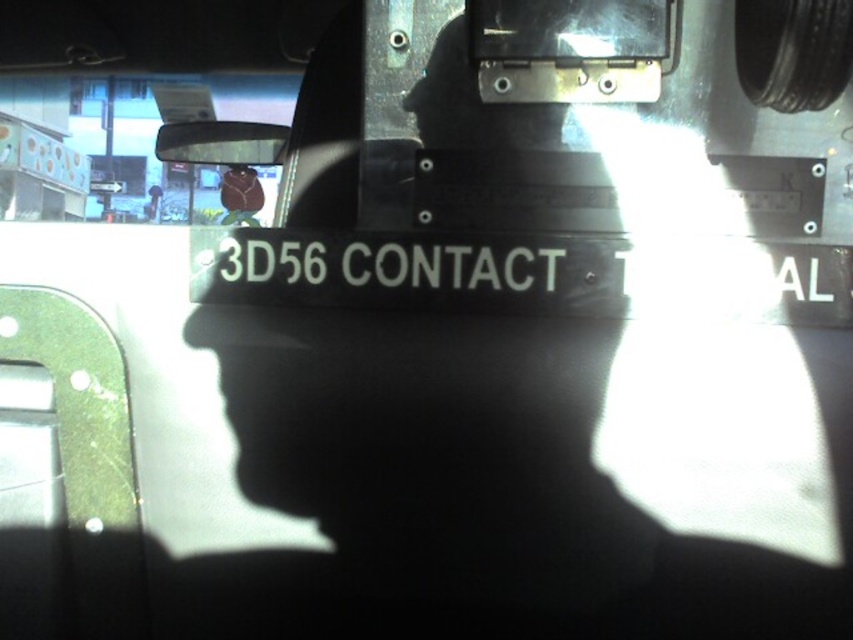
Question: Is white plastic sign at center bigger than clear plastic view mirror at upper left?

Choices:
 (A) yes
 (B) no

Answer: (B)

Question: Is white plastic sign at center to the left of clear plastic view mirror at upper left from the viewer's perspective?

Choices:
 (A) no
 (B) yes

Answer: (A)

Question: Is white plastic sign at center positioned in front of clear plastic view mirror at upper left?

Choices:
 (A) no
 (B) yes

Answer: (B)

Question: Among these objects, which one is nearest to the camera?

Choices:
 (A) clear plastic view mirror at upper left
 (B) white plastic sign at center

Answer: (B)